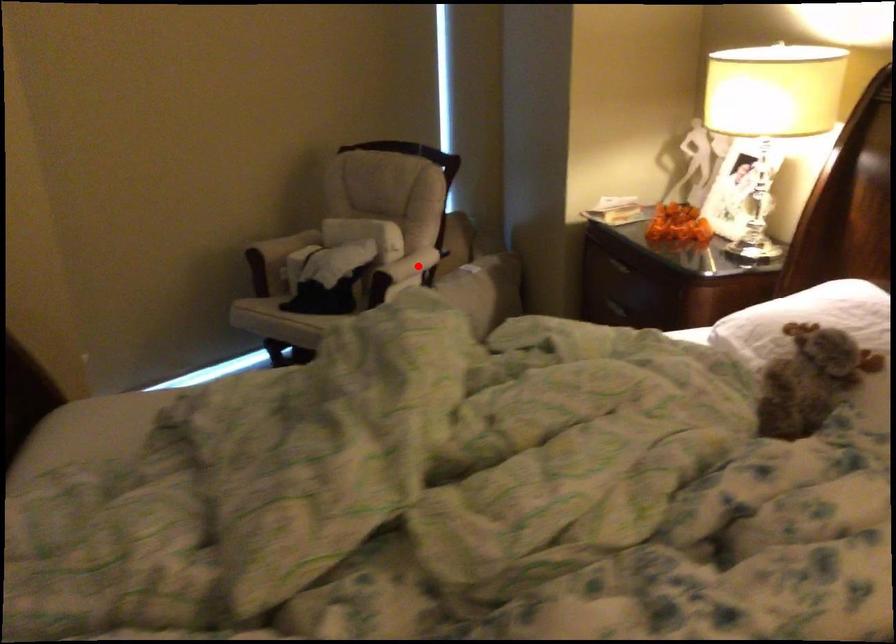
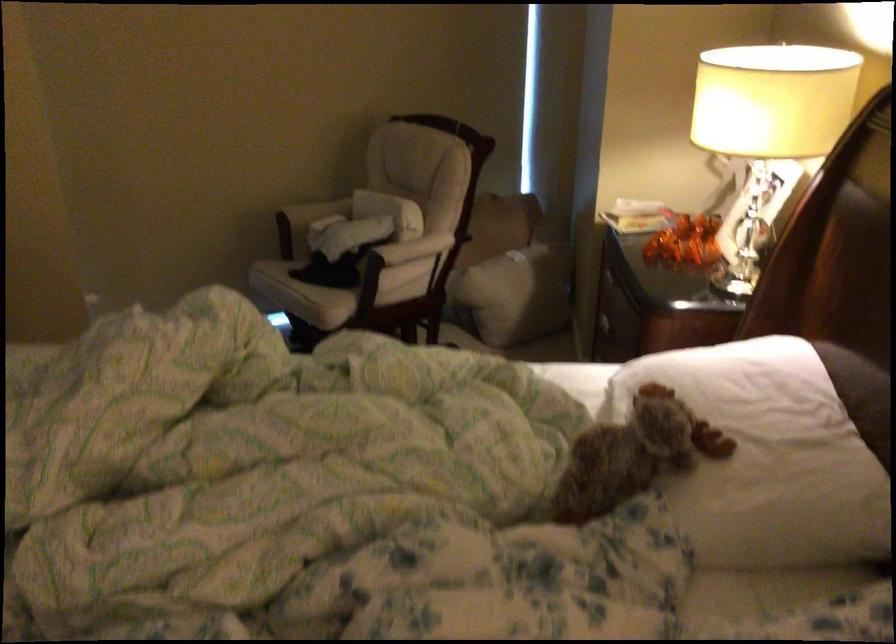
Find the pixel in the second image that matches the highlighted location in the first image.

(415, 250)